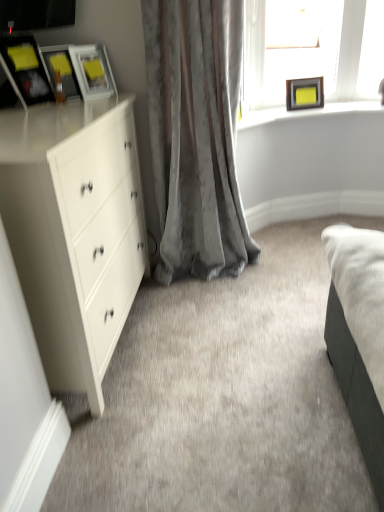
In order to face matte white picture frame at upper left, which is the 2th picture frame from right to left, should I rotate leftwards or rightwards?

To face it directly, rotate left by 13.358 degrees.

Where is `velvet gray curtain at center`? The width and height of the screenshot is (384, 512). velvet gray curtain at center is located at coordinates (196, 135).

The width and height of the screenshot is (384, 512). Describe the element at coordinates (307, 112) in the screenshot. I see `matte wooden frame at upper right` at that location.

Measure the distance between matte black picture frame at upper right, which ranks as the first picture frame in right-to-left order, and camera.

The distance of matte black picture frame at upper right, which ranks as the first picture frame in right-to-left order, from camera is 8.45 feet.

Describe the element at coordinates (61, 71) in the screenshot. I see `matte black picture frame at upper left, marked as the third picture frame in a right-to-left arrangement` at that location.

Find the location of a particular element. matte white picture frame at upper left, the second picture frame when ordered from back to front is located at coordinates (93, 71).

Is matte black picture frame at upper right, which is the 1th picture frame in back-to-front order, facing away from matte black picture frame at upper left, which is the third picture frame in back-to-front order?

No, matte black picture frame at upper right, which is the 1th picture frame in back-to-front order,'s orientation is not away from matte black picture frame at upper left, which is the third picture frame in back-to-front order.

From a real-world perspective, is matte black picture frame at upper right, which ranks as the fourth picture frame in left-to-right order, located higher than matte black picture frame at upper left, which is the third picture frame in back-to-front order?

No, from a real-world perspective, matte black picture frame at upper right, which ranks as the fourth picture frame in left-to-right order, is not above matte black picture frame at upper left, which is the third picture frame in back-to-front order.

Considering the sizes of objects matte white picture frame at upper left, placed as the 3th picture frame when sorted from front to back, and white matte chest of drawers at left in the image provided, who is shorter, matte white picture frame at upper left, placed as the 3th picture frame when sorted from front to back, or white matte chest of drawers at left?

matte white picture frame at upper left, placed as the 3th picture frame when sorted from front to back, is shorter.

How different are the orientations of matte white picture frame at upper left, the second picture frame when ordered from back to front, and white matte chest of drawers at left in degrees?

47.5 degrees separate the facing orientations of matte white picture frame at upper left, the second picture frame when ordered from back to front, and white matte chest of drawers at left.

Can you confirm if matte white picture frame at upper left, the second picture frame when ordered from back to front, is positioned to the left of white matte chest of drawers at left?

Incorrect, matte white picture frame at upper left, the second picture frame when ordered from back to front, is not on the left side of white matte chest of drawers at left.

From a real-world perspective, does matte white picture frame at upper left, which is the 2th picture frame from right to left, stand above white matte chest of drawers at left?

Yes, from a real-world perspective, matte white picture frame at upper left, which is the 2th picture frame from right to left, is on top of white matte chest of drawers at left.

From a real-world perspective, is velvet gray curtain at center on top of matte wooden frame at upper right?

Actually, velvet gray curtain at center is physically below matte wooden frame at upper right in the real world.

Does velvet gray curtain at center have a greater height compared to matte wooden frame at upper right?

Yes, velvet gray curtain at center is taller than matte wooden frame at upper right.

Considering the relative positions of velvet gray curtain at center and matte wooden frame at upper right in the image provided, is velvet gray curtain at center to the left of matte wooden frame at upper right from the viewer's perspective?

Answer: Correct, you'll find velvet gray curtain at center to the left of matte wooden frame at upper right.

Could matte wooden frame at upper right be considered to be inside velvet gray curtain at center?

No, matte wooden frame at upper right is not a part of velvet gray curtain at center.

Which point is more forward, (362, 106) or (264, 38)?

Point (264, 38)

Are matte wooden frame at upper right and clear glass frame at upper right far apart?

Actually, matte wooden frame at upper right and clear glass frame at upper right are a little close together.

From the image's perspective, is matte wooden frame at upper right located above or below clear glass frame at upper right?

matte wooden frame at upper right is situated lower than clear glass frame at upper right in the image.

Which is more to the right, matte wooden frame at upper right or clear glass frame at upper right?

matte wooden frame at upper right is more to the right.

Is matte black picture frame at upper right, which is the 1th picture frame in back-to-front order, with clear glass frame at upper right?

matte black picture frame at upper right, which is the 1th picture frame in back-to-front order, and clear glass frame at upper right are not in contact.

Is point (294, 90) in front of point (331, 97)?

Yes, it is in front of point (331, 97).

Find the location of `window that appears on the left of matte black picture frame at upper right, positioned as the 4th picture frame in front-to-back order`. window that appears on the left of matte black picture frame at upper right, positioned as the 4th picture frame in front-to-back order is located at coordinates (313, 56).

In terms of width, does white matte chest of drawers at left look wider or thinner when compared to matte black picture frame at upper right, which ranks as the fourth picture frame in left-to-right order?

Clearly, white matte chest of drawers at left has more width compared to matte black picture frame at upper right, which ranks as the fourth picture frame in left-to-right order.

How distant is white matte chest of drawers at left from matte black picture frame at upper right, which is the 1th picture frame in back-to-front order?

5.45 feet.

Is white matte chest of drawers at left beside matte black picture frame at upper right, positioned as the 4th picture frame in front-to-back order?

No, white matte chest of drawers at left is not touching matte black picture frame at upper right, positioned as the 4th picture frame in front-to-back order.

Which object is more forward, white matte chest of drawers at left or matte black picture frame at upper right, which ranks as the fourth picture frame in left-to-right order?

white matte chest of drawers at left.

Which is further, (293, 83) or (193, 229)?

The point (293, 83) is behind.

From the image's perspective, relative to velvet gray curtain at center, is matte black picture frame at upper right, which ranks as the fourth picture frame in left-to-right order, above or below?

From the image's perspective, matte black picture frame at upper right, which ranks as the fourth picture frame in left-to-right order, appears above velvet gray curtain at center.

Is matte black picture frame at upper right, which ranks as the fourth picture frame in left-to-right order, wider than velvet gray curtain at center?

Incorrect, the width of matte black picture frame at upper right, which ranks as the fourth picture frame in left-to-right order, does not surpass that of velvet gray curtain at center.

Where is `the 2nd picture frame behind the matte black picture frame at upper left, acting as the second picture frame starting from the left, counting from the anchor's position`? The width and height of the screenshot is (384, 512). the 2nd picture frame behind the matte black picture frame at upper left, acting as the second picture frame starting from the left, counting from the anchor's position is located at coordinates pos(304,93).

From a real-world perspective, starting from the white matte chest of drawers at left, which picture frame is the 3rd one vertically above it? Please provide its 2D coordinates.

[(93, 71)]

Looking at the image, which one is located further to white matte chest of drawers at left, matte white picture frame at upper left, placed as the 3th picture frame when sorted from front to back, or velvet gray curtain at center?

The object further to white matte chest of drawers at left is matte white picture frame at upper left, placed as the 3th picture frame when sorted from front to back.

When comparing their distances from matte black picture frame at upper left, which ranks as the first picture frame in left-to-right order, does matte wooden frame at upper right or matte black picture frame at upper right, which ranks as the fourth picture frame in left-to-right order, seem closer?

Based on the image, matte wooden frame at upper right appears to be nearer to matte black picture frame at upper left, which ranks as the first picture frame in left-to-right order.

When comparing their distances from matte black picture frame at upper left, which is the third picture frame in back-to-front order, does matte black picture frame at upper right, positioned as the 4th picture frame in front-to-back order, or matte white picture frame at upper left, which is the 2th picture frame from right to left, seem further?

Among the two, matte black picture frame at upper right, positioned as the 4th picture frame in front-to-back order, is located further to matte black picture frame at upper left, which is the third picture frame in back-to-front order.

Considering their positions, is matte black picture frame at upper right, which ranks as the fourth picture frame in left-to-right order, positioned closer to matte black picture frame at upper left, which is the 2th picture frame in front-to-back order, than white matte chest of drawers at left?

white matte chest of drawers at left lies closer to matte black picture frame at upper left, which is the 2th picture frame in front-to-back order, than the other object.

Considering their positions, is velvet gray curtain at center positioned further to white matte chest of drawers at left than clear glass frame at upper right?

clear glass frame at upper right is further to white matte chest of drawers at left.

From the image, which object appears to be nearer to matte black picture frame at upper left, which is the third picture frame in back-to-front order, matte black picture frame at upper right, positioned as the 4th picture frame in front-to-back order, or velvet gray curtain at center?

velvet gray curtain at center.

Which object lies nearer to the anchor point matte black picture frame at upper left, which is the 2th picture frame in front-to-back order, matte white picture frame at upper left, the second picture frame when ordered from back to front, or matte black picture frame at upper left, placed as the first picture frame when sorted from front to back?

matte white picture frame at upper left, the second picture frame when ordered from back to front.

Looking at this image, from the image, which object appears to be nearer to clear glass frame at upper right, matte white picture frame at upper left, placed as the 3th picture frame when sorted from front to back, or matte black picture frame at upper right, positioned as the 4th picture frame in front-to-back order?

Among the two, matte black picture frame at upper right, positioned as the 4th picture frame in front-to-back order, is located nearer to clear glass frame at upper right.

Find the location of `window between white matte chest of drawers at left and matte black picture frame at upper right, which ranks as the first picture frame in right-to-left order, in the front-back direction`. window between white matte chest of drawers at left and matte black picture frame at upper right, which ranks as the first picture frame in right-to-left order, in the front-back direction is located at coordinates (313, 56).

Image resolution: width=384 pixels, height=512 pixels. Identify the location of window between velvet gray curtain at center and matte wooden frame at upper right in the front-back direction. (x=313, y=56).

Find the location of a particular element. The image size is (384, 512). window situated between matte white picture frame at upper left, which is the 3th picture frame from left to right, and matte black picture frame at upper right, positioned as the 4th picture frame in front-to-back order, from left to right is located at coordinates (313, 56).

Locate an element on the screen. window between matte black picture frame at upper left, which appears as the fourth picture frame when viewed from the right, and matte wooden frame at upper right from left to right is located at coordinates (313, 56).